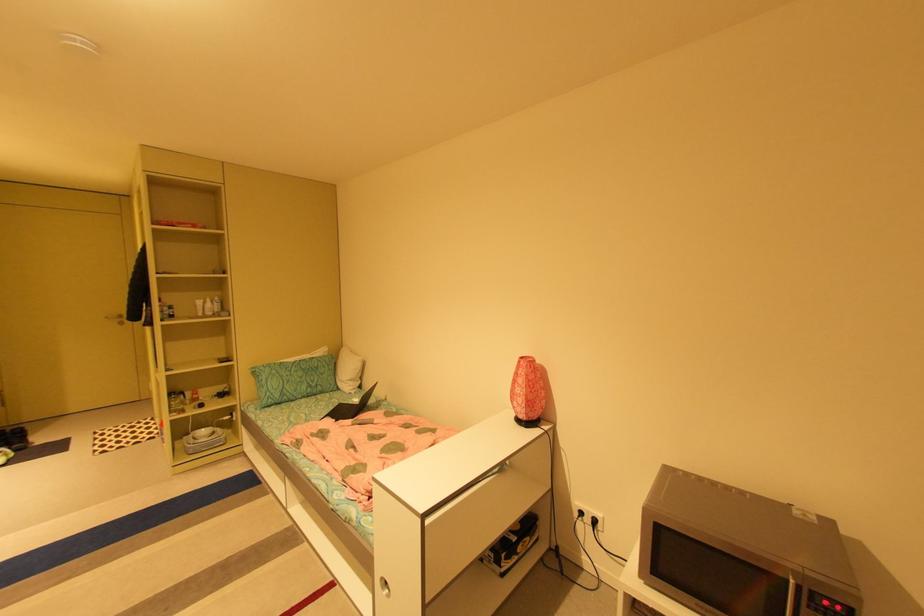
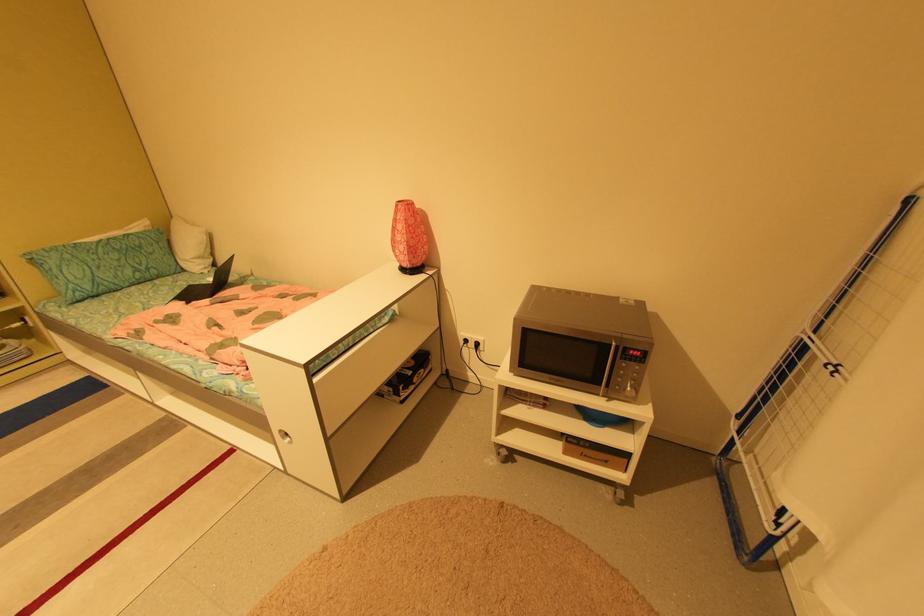
In the second image, find the point that corresponds to the point at 322,365 in the first image.

(142, 244)